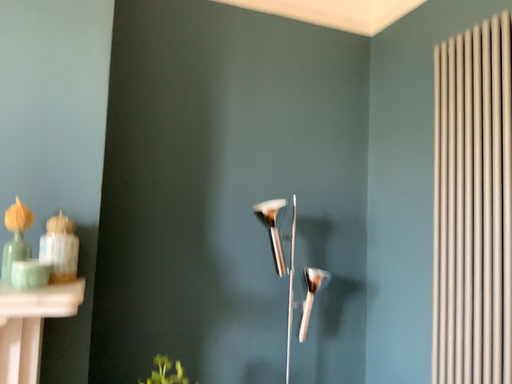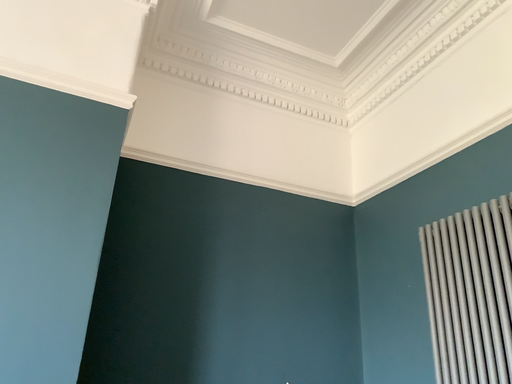
Question: Which way did the camera rotate in the video?

Choices:
 (A) rotated downward
 (B) rotated upward

Answer: (B)